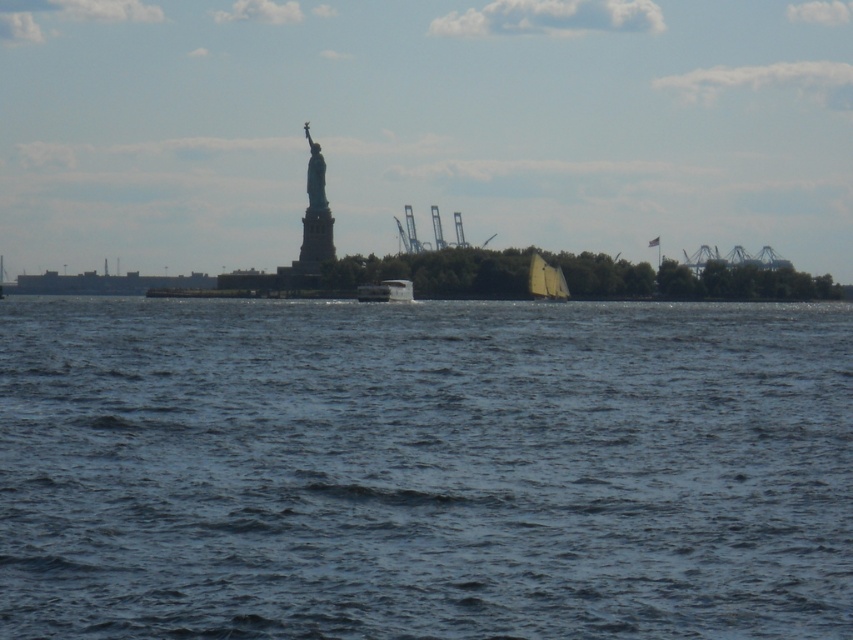
You are a photographer trying to capture the Statue of Liberty in the background. You have two points marked on your camera screen at coordinates point (x=316, y=196) and point (x=541, y=294). Which point should you focus on to ensure the Statue of Liberty is in focus?

Point (x=316, y=196) is behind point (x=541, y=294), so focusing on point (x=316, y=196) will ensure the Statue of Liberty in the background is in focus.

You are a tourist standing on the dock and want to take a photo of the metallic statue at upper center and the white sailboat at center. Which object should you focus on first if you want to capture both in the same frame without moving the camera?

You should focus on the metallic statue at upper center first because it is positioned over the white sailboat at center, meaning it is closer to the camera and would be in focus if you set the focus on it first.

In the scene shown: You are a photographer planning to capture the Statue of Liberty and the surrounding water in a single shot. Based on the scene, can you confirm if the blue water at center is located directly below the metallic statue at upper center?

Yes, the blue water at center is positioned under the metallic statue at upper center, so it will be directly below in the photo.